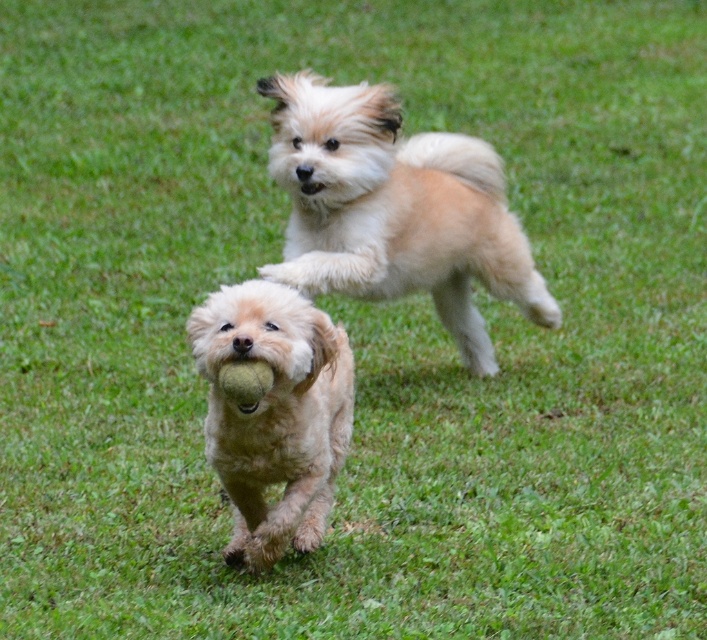
Question: Does fuzzy beige dog at upper center appear over fuzzy beige dog at center?

Choices:
 (A) yes
 (B) no

Answer: (A)

Question: Among these points, which one is farthest from the camera?

Choices:
 (A) (438, 134)
 (B) (325, 472)

Answer: (A)

Question: Is fuzzy beige dog at upper center to the right of fuzzy beige dog at center from the viewer's perspective?

Choices:
 (A) no
 (B) yes

Answer: (B)

Question: Does fuzzy beige dog at upper center lie behind fuzzy beige dog at center?

Choices:
 (A) no
 (B) yes

Answer: (B)

Question: Among these objects, which one is nearest to the camera?

Choices:
 (A) fuzzy beige dog at upper center
 (B) fuzzy beige dog at center

Answer: (B)